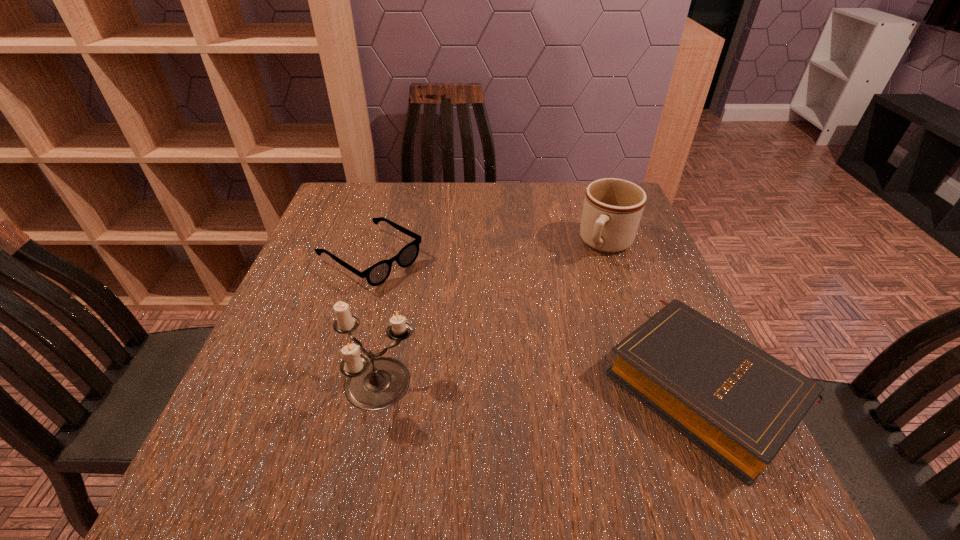
Find the location of a particular element. The image size is (960, 540). blank space at the far edge of the desktop is located at coordinates (459, 192).

Identify the location of vacant space at the near edge of the desktop. (626, 428).

I want to click on vacant space at the left edge of the desktop, so click(x=328, y=248).

Where is `vacant point at the right edge`? vacant point at the right edge is located at coordinates (595, 266).

Locate an element on the screen. vacant space at the far left corner of the desktop is located at coordinates (330, 224).

The height and width of the screenshot is (540, 960). In order to click on vacant space at the far right corner of the desktop in this screenshot , I will do `click(575, 200)`.

You are a GUI agent. You are given a task and a screenshot of the screen. Output one action in this format:
    pyautogui.click(x=<x>, y=<y>)
    Task: Click on the blank region between the spectacles and the Bible
    This screenshot has height=540, width=960.
    Given the screenshot: What is the action you would take?
    pyautogui.click(x=537, y=321)

The image size is (960, 540). I want to click on free space between the candle holder and the spectacles, so tap(375, 322).

The width and height of the screenshot is (960, 540). Find the location of `free point between the Bible and the spectacles`. free point between the Bible and the spectacles is located at coordinates (537, 321).

Find the location of `empty location between the spectacles and the Bible`. empty location between the spectacles and the Bible is located at coordinates (537, 321).